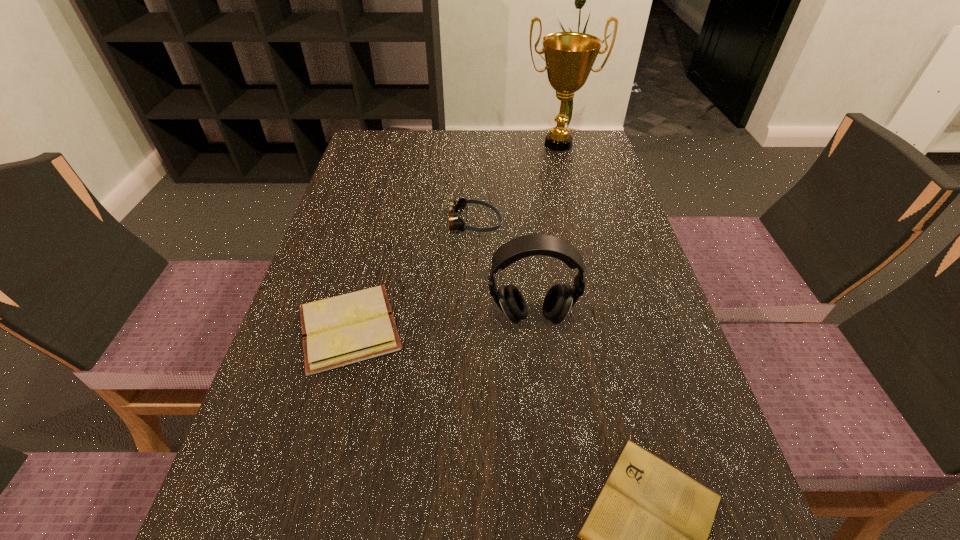
Where is `award`? award is located at coordinates (569, 56).

The image size is (960, 540). I want to click on the tallest object, so click(569, 56).

Identify the location of earphone. (558, 301).

In order to click on the second farthest object in this screenshot , I will do coord(456,206).

Locate an element on the screen. goggles is located at coordinates click(x=456, y=206).

Locate an element on the screen. the second shortest object is located at coordinates (341, 330).

Locate an element on the screen. The width and height of the screenshot is (960, 540). diary is located at coordinates (341, 330).

Find the location of a particular element. Image resolution: width=960 pixels, height=540 pixels. blank area located on the front view with handles of the farthest object is located at coordinates (579, 226).

This screenshot has width=960, height=540. I want to click on vacant space situated on the ear cups of the earphone, so click(x=554, y=526).

Image resolution: width=960 pixels, height=540 pixels. Identify the location of vacant space situated through the lenses of the second farthest object. (543, 223).